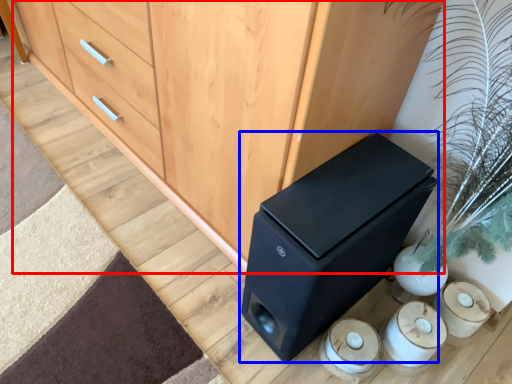
Question: Which of the following is the closest to the observer, chest of drawers (highlighted by a red box) or furniture (highlighted by a blue box)?

Choices:
 (A) chest of drawers
 (B) furniture

Answer: (A)